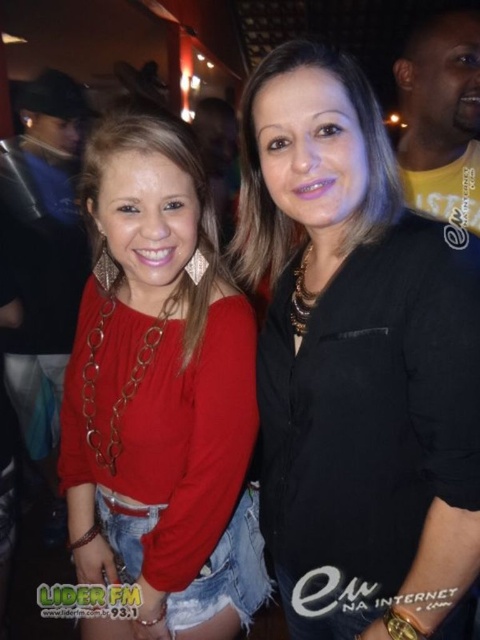
Question: Is black matte shirt at center wider than matte red blouse at center?

Choices:
 (A) no
 (B) yes

Answer: (A)

Question: Which object is farther from the camera taking this photo?

Choices:
 (A) matte red blouse at center
 (B) black matte shirt at center

Answer: (A)

Question: Does black matte shirt at center appear on the right side of matte red blouse at center?

Choices:
 (A) yes
 (B) no

Answer: (A)

Question: Does black matte shirt at center appear on the right side of matte red blouse at center?

Choices:
 (A) yes
 (B) no

Answer: (A)